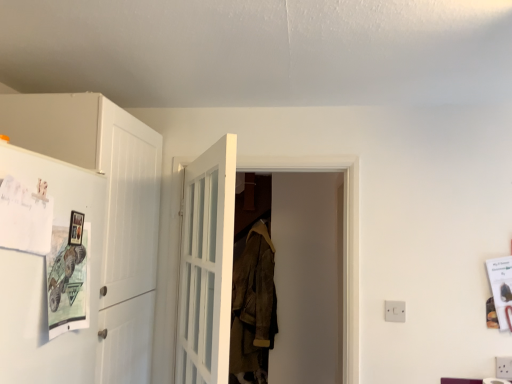
The height and width of the screenshot is (384, 512). In order to click on white glass door at center, the 2th door viewed from the back in this screenshot , I will do `click(206, 266)`.

Describe the element at coordinates (91, 237) in the screenshot. This screenshot has width=512, height=384. I see `white matte refrigerator at left` at that location.

Find the location of a particular element. Image resolution: width=512 pixels, height=384 pixels. white plastic electric outlet at lower right is located at coordinates (394, 311).

Describe the element at coordinates (394, 311) in the screenshot. I see `white plastic electric outlet at lower right` at that location.

Where is `white glass door at center, the first door positioned from the front`? white glass door at center, the first door positioned from the front is located at coordinates (206, 266).

Considering the positions of point (143, 204) and point (249, 240), is point (143, 204) closer or farther from the camera than point (249, 240)?

Point (143, 204) is positioned closer to the camera compared to point (249, 240).

Is white matte refrigerator at left wider or thinner than leather jacket at center?

Considering their sizes, white matte refrigerator at left looks broader than leather jacket at center.

Find the location of a particular element. laundry on the right of white matte refrigerator at left is located at coordinates (253, 308).

Is white matte refrigerator at left next to leather jacket at center?

No, white matte refrigerator at left is not beside leather jacket at center.

Based on the photo, from the image's perspective, is white glass door at center, the 2th door viewed from the back, below leather jacket at center?

Actually, white glass door at center, the 2th door viewed from the back, appears above leather jacket at center in the image.

Looking at this image, can you confirm if white glass door at center, the first door positioned from the front, is bigger than leather jacket at center?

No, white glass door at center, the first door positioned from the front, is not bigger than leather jacket at center.

The height and width of the screenshot is (384, 512). Identify the location of laundry on the right of white glass door at center, the 2th door viewed from the back. (253, 308).

What's the angular difference between white glass door at center, the 2th door viewed from the back, and leather jacket at center's facing directions?

114 degrees separate the facing orientations of white glass door at center, the 2th door viewed from the back, and leather jacket at center.

Are white matte refrigerator at left and white plastic electric outlet at lower right making contact?

No, white matte refrigerator at left is not touching white plastic electric outlet at lower right.

Considering the positions of objects white matte refrigerator at left and white plastic electric outlet at lower right in the image provided, who is behind, white matte refrigerator at left or white plastic electric outlet at lower right?

Positioned behind is white plastic electric outlet at lower right.

Is white matte refrigerator at left positioned with its back to white plastic electric outlet at lower right?

That's not correct — white matte refrigerator at left is not looking away from white plastic electric outlet at lower right.

From the image's perspective, which is above, white matte refrigerator at left or white plastic electric outlet at lower right?

white matte refrigerator at left is shown above in the image.

How many degrees apart are the facing directions of white wooden door at center, which ranks as the second door in front-to-back order, and white matte refrigerator at left?

white wooden door at center, which ranks as the second door in front-to-back order, and white matte refrigerator at left are facing 90.6 degrees away from each other.

In the scene shown: Is there a large distance between white wooden door at center, which ranks as the second door in front-to-back order, and white matte refrigerator at left?

No, white wooden door at center, which ranks as the second door in front-to-back order, is not far away from white matte refrigerator at left.

From the image's perspective, is white wooden door at center, the 1th door in the back-to-front sequence, above white matte refrigerator at left?

No, from the image's perspective, white wooden door at center, the 1th door in the back-to-front sequence, is not over white matte refrigerator at left.

In terms of size, does white wooden door at center, the 1th door in the back-to-front sequence, appear bigger or smaller than white matte refrigerator at left?

Considering their sizes, white wooden door at center, the 1th door in the back-to-front sequence, takes up less space than white matte refrigerator at left.

Are leather jacket at center and white wooden door at center, which ranks as the second door in front-to-back order, beside each other?

No, leather jacket at center is not in contact with white wooden door at center, which ranks as the second door in front-to-back order.

The image size is (512, 384). Identify the location of door lying on the right of leather jacket at center. (343, 236).

Would you say leather jacket at center is outside white wooden door at center, which ranks as the second door in front-to-back order?

Yes, leather jacket at center is located beyond the bounds of white wooden door at center, which ranks as the second door in front-to-back order.

Is point (272, 334) farther from viewer compared to point (262, 157)?

Yes, it is.

Visually, is leather jacket at center positioned to the left or to the right of white matte refrigerator at left?

leather jacket at center is to the right of white matte refrigerator at left.

Relative to white matte refrigerator at left, is leather jacket at center in front or behind?

leather jacket at center is positioned farther from the viewer than white matte refrigerator at left.

Can you tell me how much leather jacket at center and white matte refrigerator at left differ in facing direction?

90 degrees separate the facing orientations of leather jacket at center and white matte refrigerator at left.

From the image's perspective, relative to white matte refrigerator at left, is leather jacket at center above or below?

Clearly, from the image's perspective, leather jacket at center is below white matte refrigerator at left.

Is leather jacket at center oriented away from white glass door at center, the first door positioned from the front?

No.

From a real-world perspective, is leather jacket at center under white glass door at center, the first door positioned from the front?

Yes.

Does leather jacket at center contain white glass door at center, the first door positioned from the front?

Definitely not — white glass door at center, the first door positioned from the front, is not inside leather jacket at center.

Identify the location of cabinetry in front of the leather jacket at center. (91, 237).

The height and width of the screenshot is (384, 512). In order to click on laundry that appears on the right of white glass door at center, the first door positioned from the front in this screenshot , I will do `click(253, 308)`.

Which object lies further to the anchor point white glass door at center, the 2th door viewed from the back, leather jacket at center or white plastic electric outlet at lower right?

Among the two, leather jacket at center is located further to white glass door at center, the 2th door viewed from the back.

Looking at this image, based on their spatial positions, is leather jacket at center or white glass door at center, the first door positioned from the front, closer to white wooden door at center, the 1th door in the back-to-front sequence?

Based on the image, white glass door at center, the first door positioned from the front, appears to be nearer to white wooden door at center, the 1th door in the back-to-front sequence.

Looking at the image, which one is located further to white plastic electric outlet at lower right, white wooden door at center, the 1th door in the back-to-front sequence, or leather jacket at center?

leather jacket at center is further to white plastic electric outlet at lower right.

Estimate the real-world distances between objects in this image. Which object is further from leather jacket at center, white matte refrigerator at left or white glass door at center, the 2th door viewed from the back?

white matte refrigerator at left lies further to leather jacket at center than the other object.

Based on their spatial positions, is white glass door at center, the first door positioned from the front, or white matte refrigerator at left further from leather jacket at center?

Based on the image, white matte refrigerator at left appears to be further to leather jacket at center.

Considering their positions, is white glass door at center, the 2th door viewed from the back, positioned closer to white wooden door at center, which ranks as the second door in front-to-back order, than white plastic electric outlet at lower right?

The object closer to white wooden door at center, which ranks as the second door in front-to-back order, is white plastic electric outlet at lower right.

Based on the photo, considering their positions, is white plastic electric outlet at lower right positioned closer to leather jacket at center than white glass door at center, the 2th door viewed from the back?

The object closer to leather jacket at center is white glass door at center, the 2th door viewed from the back.

Estimate the real-world distances between objects in this image. Which object is closer to white glass door at center, the 2th door viewed from the back, white plastic electric outlet at lower right or white wooden door at center, which ranks as the second door in front-to-back order?

Among the two, white wooden door at center, which ranks as the second door in front-to-back order, is located nearer to white glass door at center, the 2th door viewed from the back.

What are the coordinates of `electric outlet between white glass door at center, the 2th door viewed from the back, and leather jacket at center in the front-back direction` in the screenshot? It's located at (394, 311).

Where is `door between white glass door at center, the first door positioned from the front, and leather jacket at center, along the z-axis`? The height and width of the screenshot is (384, 512). door between white glass door at center, the first door positioned from the front, and leather jacket at center, along the z-axis is located at coordinates (343, 236).

Find the location of a particular element. The height and width of the screenshot is (384, 512). door situated between white matte refrigerator at left and white wooden door at center, the 1th door in the back-to-front sequence, from left to right is located at coordinates (206, 266).

Identify the location of cabinetry positioned between white glass door at center, the first door positioned from the front, and leather jacket at center from near to far. This screenshot has width=512, height=384. (91, 237).